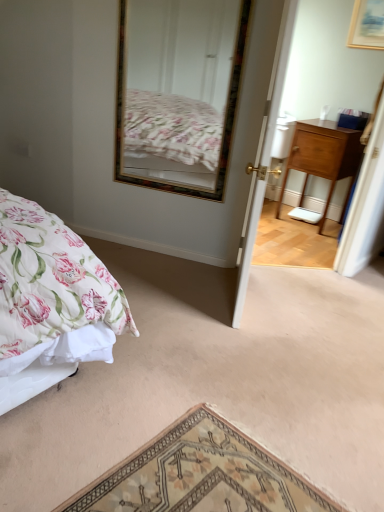
Question: Considering the relative sizes of wooden nightstand at right and wooden-framed mirror at upper center in the image provided, is wooden nightstand at right wider than wooden-framed mirror at upper center?

Choices:
 (A) no
 (B) yes

Answer: (B)

Question: Is wooden nightstand at right not near wooden-framed mirror at upper center?

Choices:
 (A) no
 (B) yes

Answer: (A)

Question: Can you confirm if wooden nightstand at right is shorter than wooden-framed mirror at upper center?

Choices:
 (A) no
 (B) yes

Answer: (B)

Question: Is wooden nightstand at right not within wooden-framed mirror at upper center?

Choices:
 (A) no
 (B) yes

Answer: (B)

Question: Could wooden-framed mirror at upper center be considered to be inside wooden nightstand at right?

Choices:
 (A) yes
 (B) no

Answer: (B)

Question: Considering the positions of wooden picture frame at upper right and white wooden door at center in the image, is wooden picture frame at upper right bigger or smaller than white wooden door at center?

Choices:
 (A) big
 (B) small

Answer: (B)

Question: In terms of height, does wooden picture frame at upper right look taller or shorter compared to white wooden door at center?

Choices:
 (A) short
 (B) tall

Answer: (A)

Question: From the image's perspective, is wooden picture frame at upper right positioned above or below white wooden door at center?

Choices:
 (A) below
 (B) above

Answer: (B)

Question: From a real-world perspective, is wooden picture frame at upper right above or below white wooden door at center?

Choices:
 (A) below
 (B) above

Answer: (B)

Question: In terms of size, does wooden nightstand at right appear bigger or smaller than wooden picture frame at upper right?

Choices:
 (A) small
 (B) big

Answer: (B)

Question: From a real-world perspective, is wooden nightstand at right physically located above or below wooden picture frame at upper right?

Choices:
 (A) above
 (B) below

Answer: (B)

Question: Is wooden nightstand at right wider or thinner than wooden picture frame at upper right?

Choices:
 (A) thin
 (B) wide

Answer: (B)

Question: Relative to wooden picture frame at upper right, is wooden nightstand at right in front or behind?

Choices:
 (A) front
 (B) behind

Answer: (B)

Question: Looking at the image, does wooden-framed mirror at upper center seem bigger or smaller compared to wooden picture frame at upper right?

Choices:
 (A) big
 (B) small

Answer: (A)

Question: In the image, is wooden-framed mirror at upper center on the left side or the right side of wooden picture frame at upper right?

Choices:
 (A) left
 (B) right

Answer: (A)